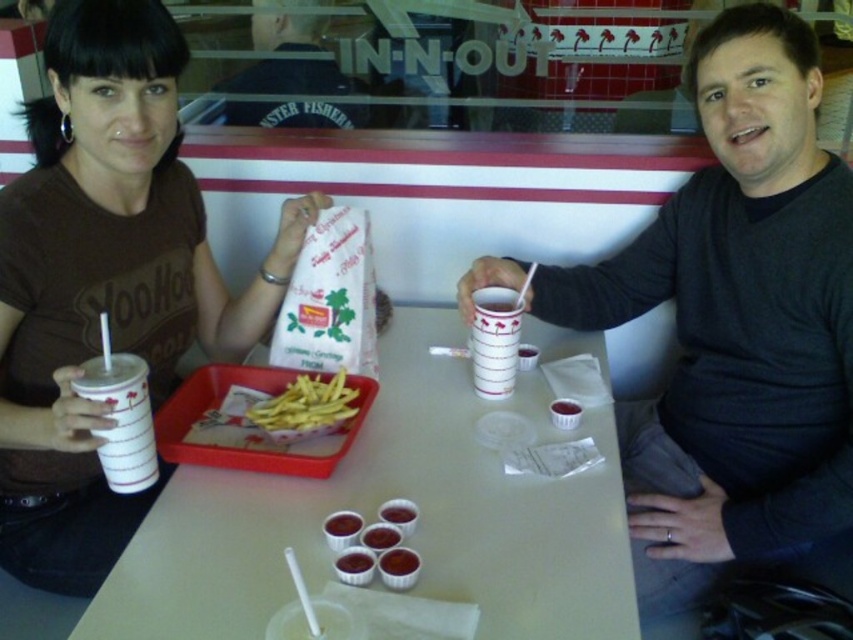
You are a customer at In N Out Burger and you want to grab your drink quickly. You see a white paper cup at left and a smooth plastic cup at center. Which cup is easier to reach if you are sitting directly in front of the table?

The white paper cup at left is closer to the viewer than the smooth plastic cup at center, so it is easier to reach.

You are a photographer taking a picture of the two people at the table. You want to focus on the person closer to the camera. Which point, point (329, 508) or point (354, 556), should you focus on?

You should focus on point (329, 508) because it is closer to the camera than point (354, 556).